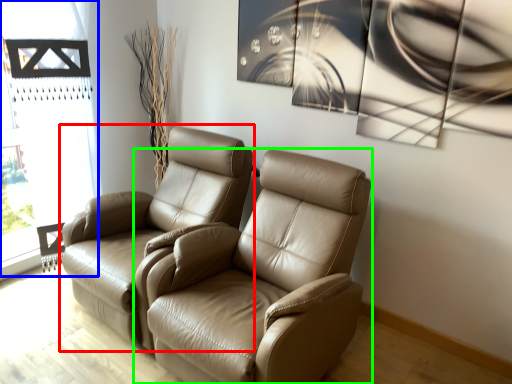
Question: Estimate the real-world distances between objects in this image. Which object is closer to chair (highlighted by a red box), window frame (highlighted by a blue box) or chair (highlighted by a green box)?

Choices:
 (A) window frame
 (B) chair

Answer: (B)